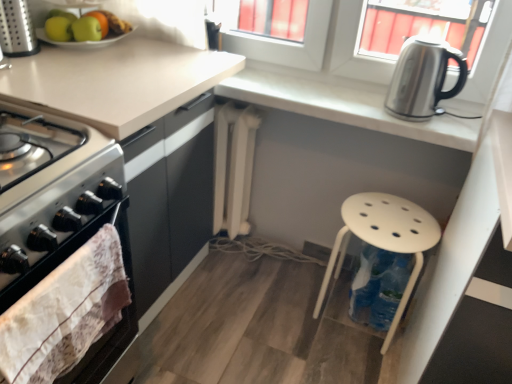
Question: From the image's perspective, is white plastic stool at lower right positioned above or below green matte apple at upper left, acting as the third apple starting from the right?

Choices:
 (A) below
 (B) above

Answer: (A)

Question: Looking at the image, does white plastic stool at lower right seem bigger or smaller compared to green matte apple at upper left, acting as the third apple starting from the right?

Choices:
 (A) big
 (B) small

Answer: (A)

Question: Considering the real-world distances, which object is farthest from the green matte apple at upper left, acting as the third apple starting from the right?

Choices:
 (A) satin silver gas stove at left
 (B) satin silver kettle at upper right
 (C) green matte apple at upper left, the second apple in the right-to-left sequence
 (D) white fabric towel at left
 (E) white plastic stool at lower right

Answer: (E)

Question: Which object is positioned farthest from the green matte apple at upper left?

Choices:
 (A) green matte apple at upper left, which is the 1th apple in left-to-right order
 (B) green matte apple at upper left, which is counted as the 3th apple, starting from the left
 (C) white plastic stool at lower right
 (D) green matte apple at upper left, the second apple in the right-to-left sequence
 (E) satin silver kettle at upper right

Answer: (C)